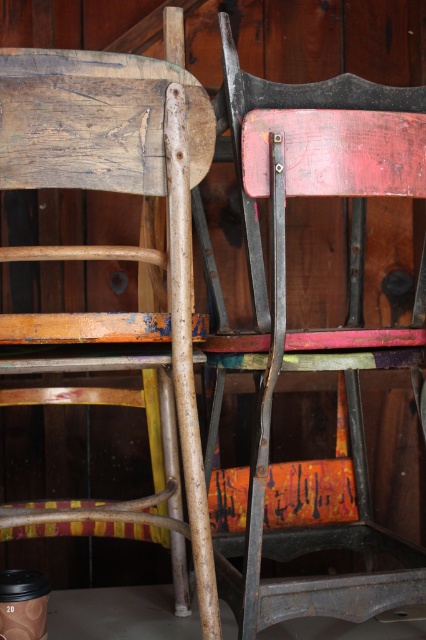
Which is more to the left, red painted wood chair at center or wooden chair at center?

wooden chair at center

Where is `red painted wood chair at center`? The image size is (426, 640). red painted wood chair at center is located at coordinates (314, 330).